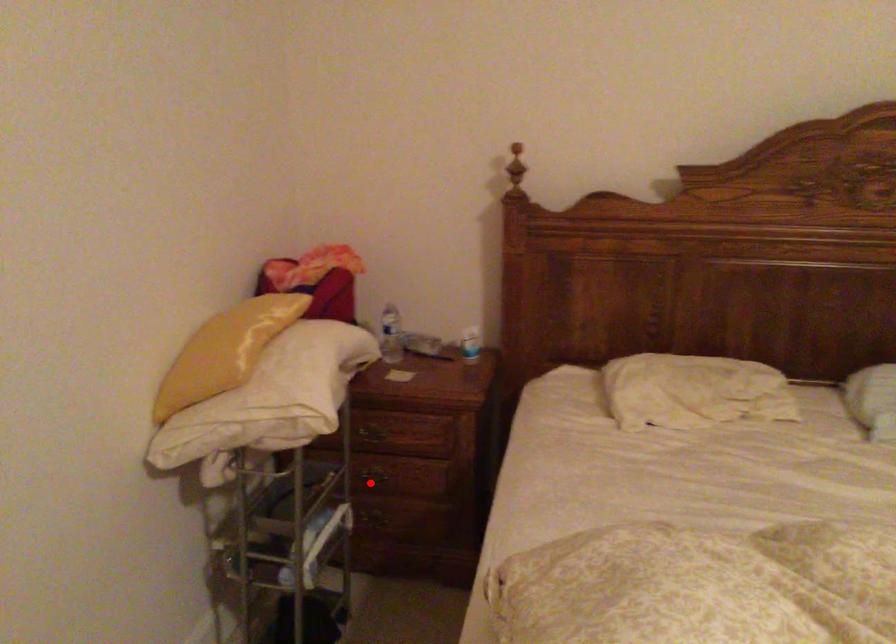
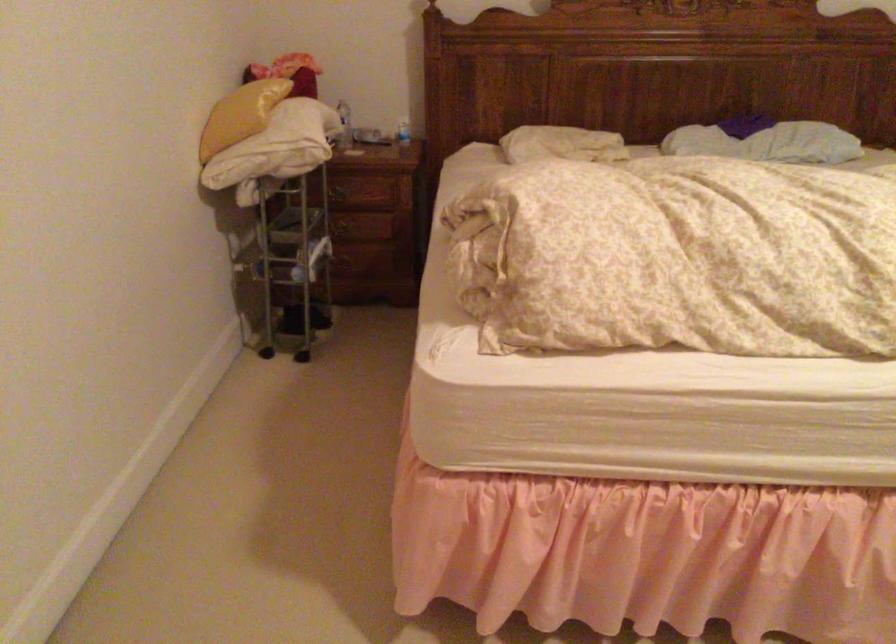
Question: I am providing you with two images of the same scene from different viewpoints. Image1 has a red point marked. In image2, the corresponding 3D location appears at what relative position? Reply with the corresponding letter.

Choices:
 (A) Closer
 (B) Farther

Answer: (B)